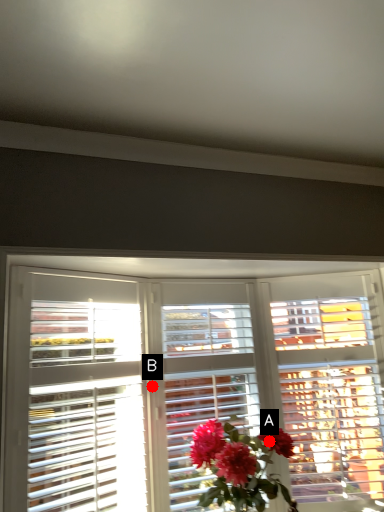
Question: Two points are circled on the image, labeled by A and B beside each circle. Among these points, which one is farthest from the camera?

Choices:
 (A) A is further
 (B) B is further

Answer: (B)